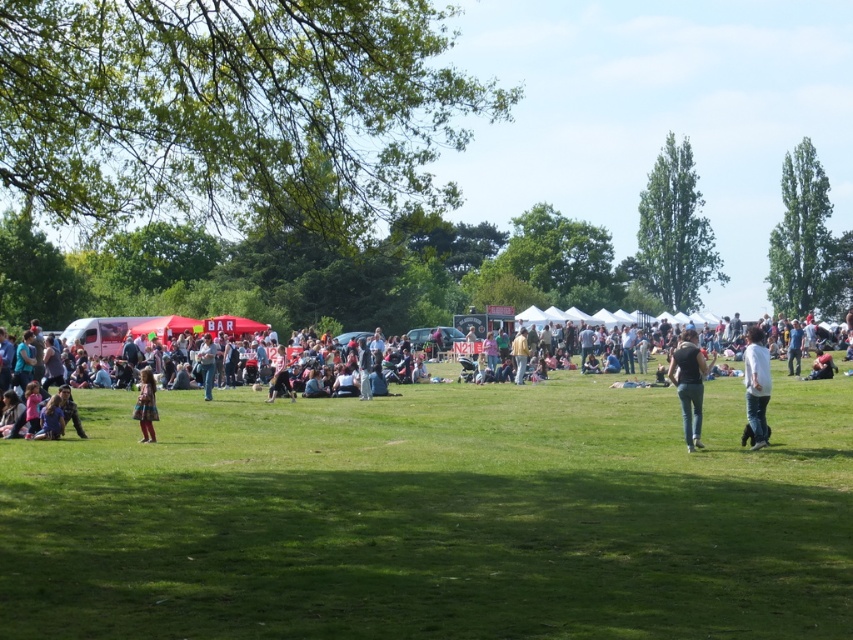
Between white cotton shirt at right and plaid fabric dress at lower left, which one has less height?

With less height is plaid fabric dress at lower left.

Can you confirm if white cotton shirt at right is thinner than plaid fabric dress at lower left?

Yes, white cotton shirt at right is thinner than plaid fabric dress at lower left.

Consider the image. Who is more forward, (769, 385) or (144, 417)?

Positioned in front is point (769, 385).

Find the location of a particular element. white cotton shirt at right is located at coordinates (756, 385).

Is green grass at center bigger than dark gray jeans at center?

Yes.

Where is `green grass at center`? The width and height of the screenshot is (853, 640). green grass at center is located at coordinates pyautogui.click(x=434, y=516).

Measure the distance between point (537, 502) and camera.

Point (537, 502) and camera are 15.05 meters apart.

Is green grass at center shorter than jeans at center?

Correct, green grass at center is not as tall as jeans at center.

The width and height of the screenshot is (853, 640). Find the location of `green grass at center`. green grass at center is located at coordinates (434, 516).